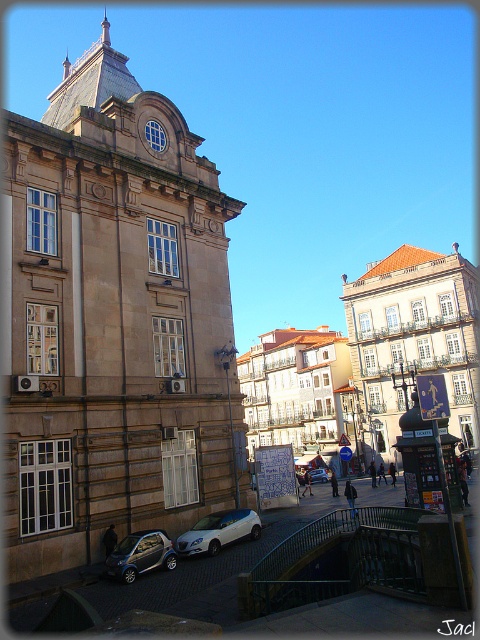
Question: Is brown stone building at center wider than shiny silver car at lower left?

Choices:
 (A) yes
 (B) no

Answer: (A)

Question: Which object appears farthest from the camera in this image?

Choices:
 (A) white matte hatchback at center
 (B) white matte car at center

Answer: (B)

Question: Is shiny silver car at lower left thinner than white matte car at center?

Choices:
 (A) no
 (B) yes

Answer: (A)

Question: Which of the following is the closest to the observer?

Choices:
 (A) white matte car at center
 (B) white matte hatchback at center

Answer: (B)

Question: Among these objects, which one is farthest from the camera?

Choices:
 (A) shiny silver car at lower left
 (B) white matte hatchback at center
 (C) brown stone building at center
 (D) white matte car at center

Answer: (D)

Question: Can you confirm if brown stone building at center is thinner than white matte car at center?

Choices:
 (A) no
 (B) yes

Answer: (A)